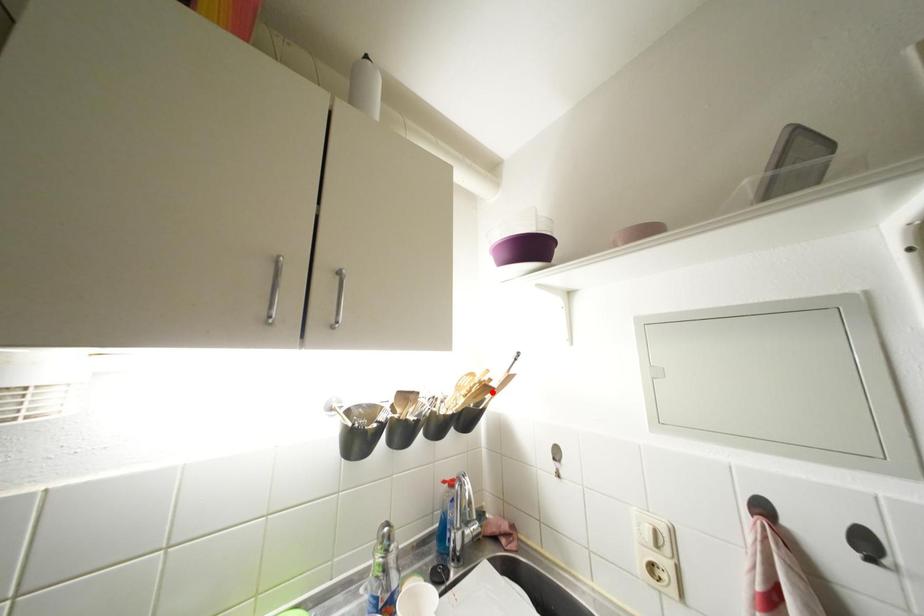
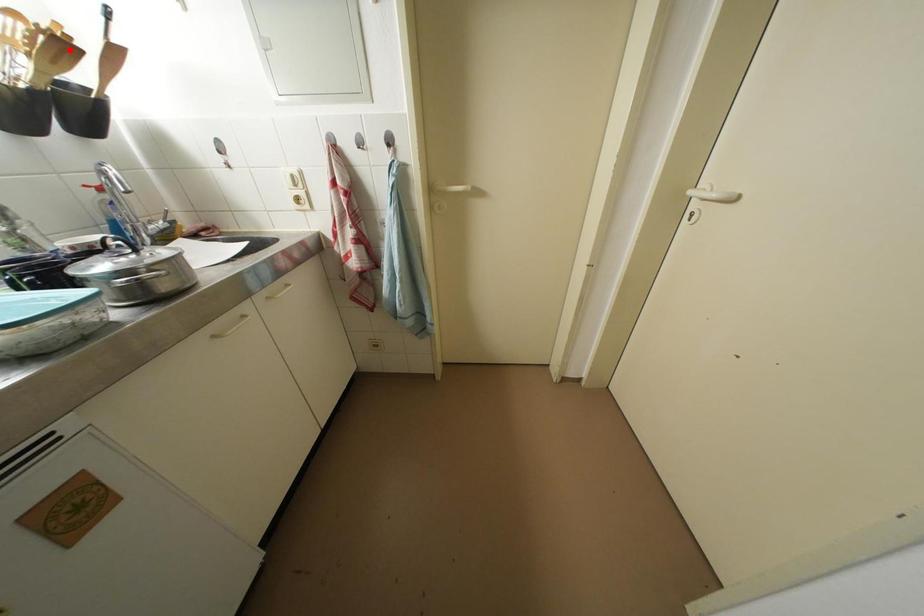
I am providing you with two images of the same scene from different viewpoints. A red point is marked on the first image and another point is marked on the second image. Is the marked point in image1 the same physical position as the marked point in image2?

Yes